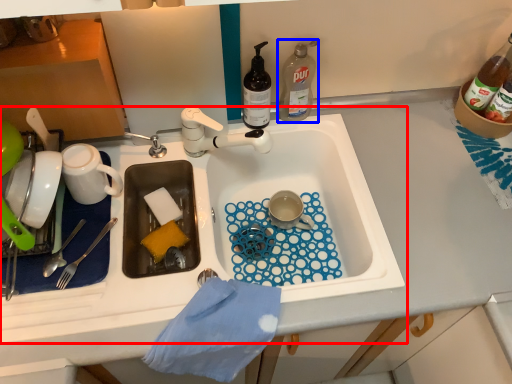
Question: Among these objects, which one is nearest to the camera, sink (highlighted by a red box) or bottle (highlighted by a blue box)?

Choices:
 (A) sink
 (B) bottle

Answer: (A)